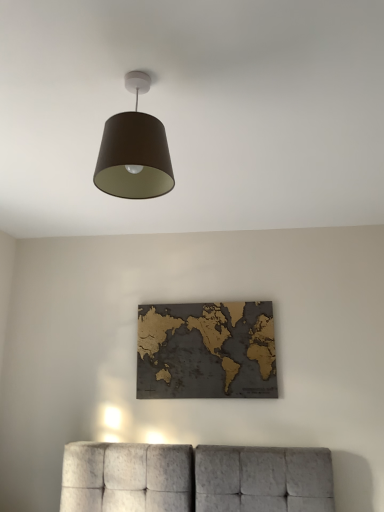
Question: Is point (148, 365) positioned closer to the camera than point (142, 151)?

Choices:
 (A) closer
 (B) farther

Answer: (B)

Question: Considering the positions of gold textured map at center and matte brown shade at upper center in the image, is gold textured map at center wider or thinner than matte brown shade at upper center?

Choices:
 (A) wide
 (B) thin

Answer: (B)

Question: Based on their positions, is gold textured map at center located to the left or right of matte brown shade at upper center?

Choices:
 (A) right
 (B) left

Answer: (A)

Question: From the image's perspective, is matte brown shade at upper center above or below gold textured map at center?

Choices:
 (A) above
 (B) below

Answer: (A)

Question: Does point (129, 193) appear closer or farther from the camera than point (200, 355)?

Choices:
 (A) closer
 (B) farther

Answer: (A)

Question: From their relative heights in the image, would you say matte brown shade at upper center is taller or shorter than gold textured map at center?

Choices:
 (A) short
 (B) tall

Answer: (A)

Question: Is matte brown shade at upper center situated inside gold textured map at center or outside?

Choices:
 (A) outside
 (B) inside

Answer: (A)